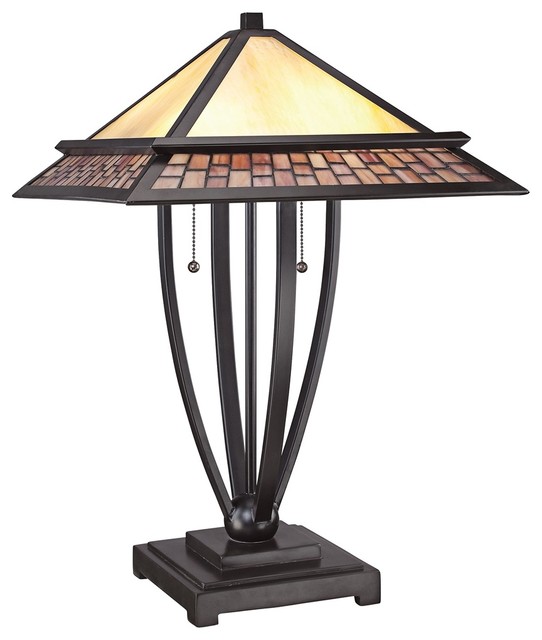
Where is `lamp top`? lamp top is located at coordinates (254, 12).